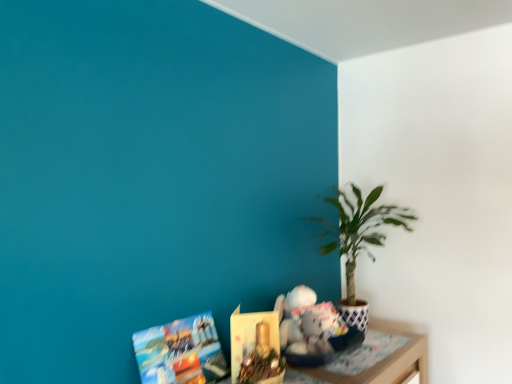
Question: From a real-world perspective, is wooden table at lower right physically located above or below matte paper book at lower left, arranged as the second book when viewed from the right?

Choices:
 (A) above
 (B) below

Answer: (B)

Question: Is wooden table at lower right taller or shorter than matte paper book at lower left, the 1th book when ordered from left to right?

Choices:
 (A) tall
 (B) short

Answer: (B)

Question: Estimate the real-world distances between objects in this image. Which object is farther from the matte paper book at lower left, arranged as the second book when viewed from the right?

Choices:
 (A) green leafy plant at right
 (B) matte paper book at lower center, the first book positioned from the right
 (C) wooden table at lower right

Answer: (A)

Question: Based on their relative distances, which object is farther from the wooden table at lower right?

Choices:
 (A) matte paper book at lower left, arranged as the second book when viewed from the right
 (B) green leafy plant at right
 (C) matte paper book at lower center, the first book positioned from the right

Answer: (A)